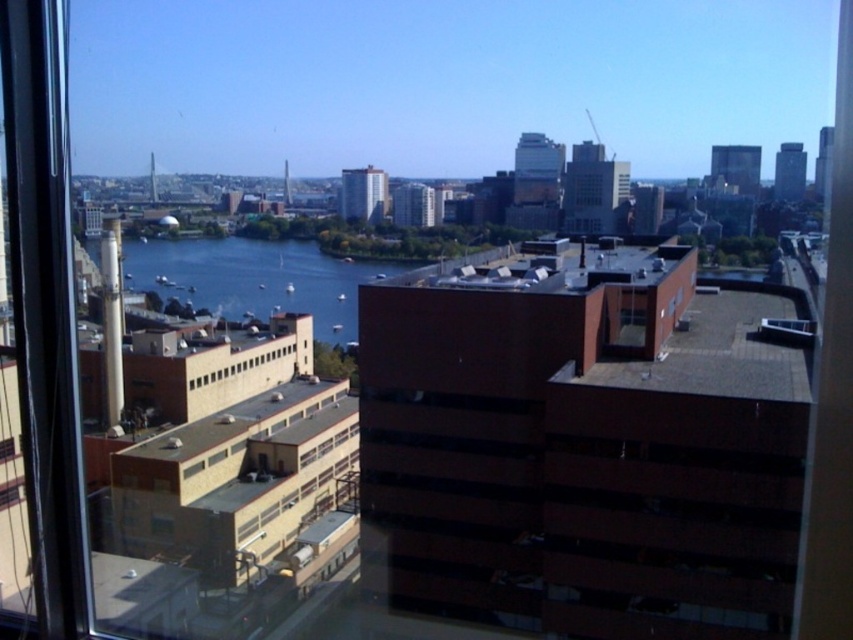
Is blue water at center positioned behind yellow matte building at lower left?

Yes, blue water at center is behind yellow matte building at lower left.

Can you confirm if blue water at center is positioned to the right of yellow matte building at lower left?

In fact, blue water at center is to the left of yellow matte building at lower left.

Is point (173, 289) in front of point (190, 371)?

No, it is behind (190, 371).

Find the location of a particular element. The height and width of the screenshot is (640, 853). blue water at center is located at coordinates (254, 278).